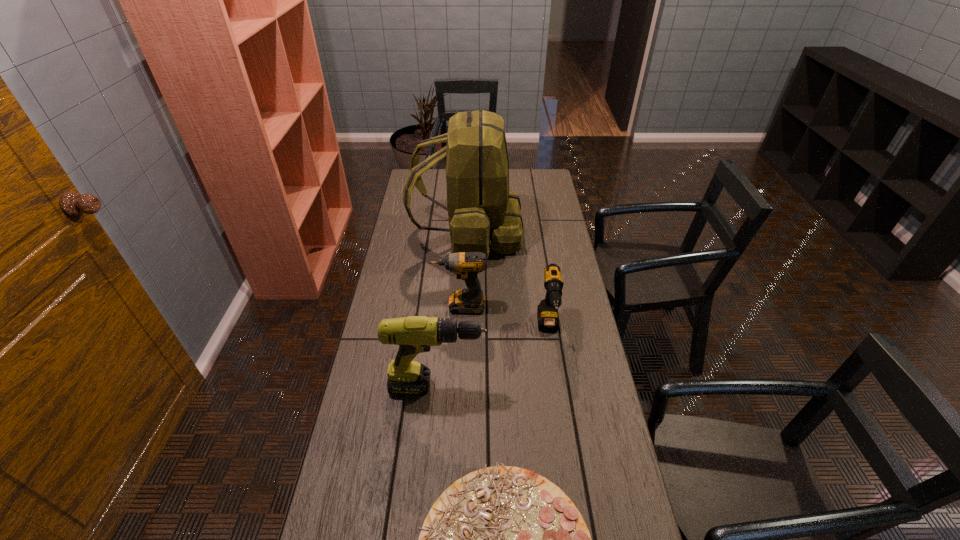
Where is `object present at the right edge`? The width and height of the screenshot is (960, 540). object present at the right edge is located at coordinates (547, 312).

In the image, there is a desktop. Identify the location of free region at the left edge. This screenshot has width=960, height=540. (379, 372).

Locate an element on the screen. free space at the right edge of the desktop is located at coordinates (547, 215).

Image resolution: width=960 pixels, height=540 pixels. In the image, there is a desktop. In order to click on vacant space at the far left corner in this screenshot , I will do `click(433, 191)`.

This screenshot has width=960, height=540. Identify the location of vacant point located between the rightmost drill and the farthest object. (508, 281).

Locate an element on the screen. Image resolution: width=960 pixels, height=540 pixels. vacant space that's between the tallest drill and the rightmost drill is located at coordinates 492,357.

Identify the location of vacant area that lies between the backpack and the rightmost drill. The width and height of the screenshot is (960, 540). (508, 281).

At what (x,y) coordinates should I click in order to perform the action: click on vacant space that's between the rightmost drill and the fourth shortest object. Please return your answer as a coordinate pair (x, y). Looking at the image, I should click on (492, 357).

Point out which object is positioned as the second nearest to the tallest object. Please provide its 2D coordinates. Your answer should be formatted as a tuple, i.e. [(x, y)], where the tuple contains the x and y coordinates of a point satisfying the conditions above.

[(547, 312)]

Choose which object is the second nearest neighbor to the farthest object. Please provide its 2D coordinates. Your answer should be formatted as a tuple, i.e. [(x, y)], where the tuple contains the x and y coordinates of a point satisfying the conditions above.

[(547, 312)]